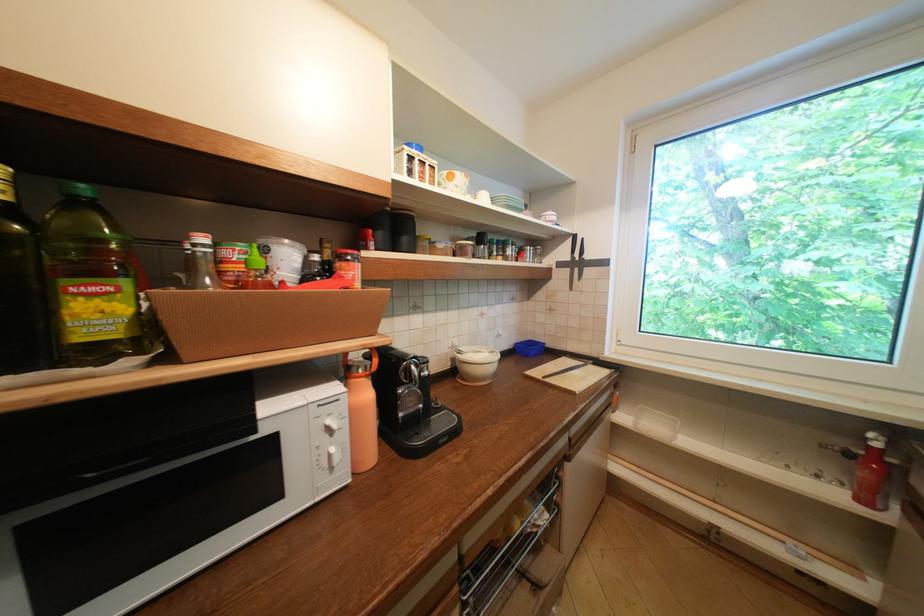
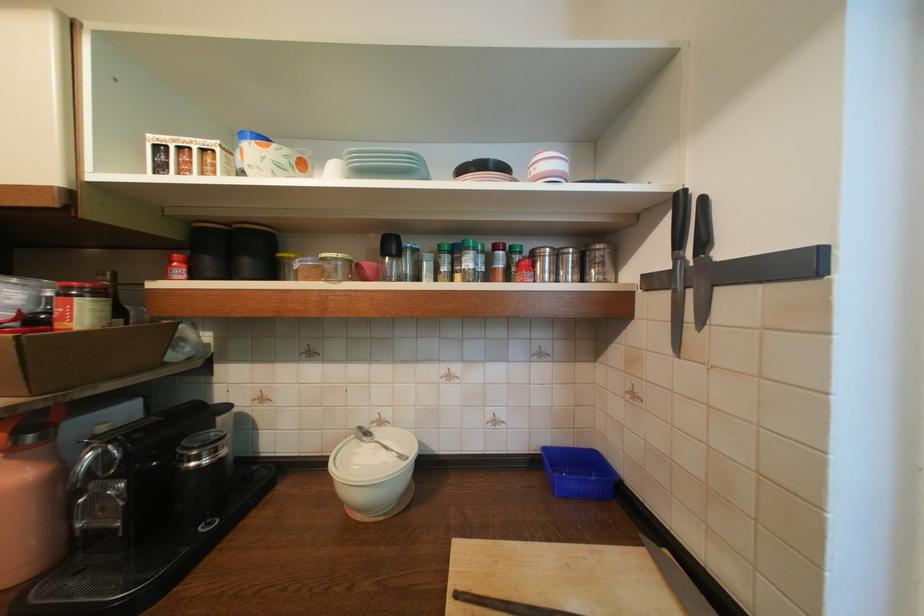
Locate, in the second image, the point that corresponds to (581,257) in the first image.

(686, 261)